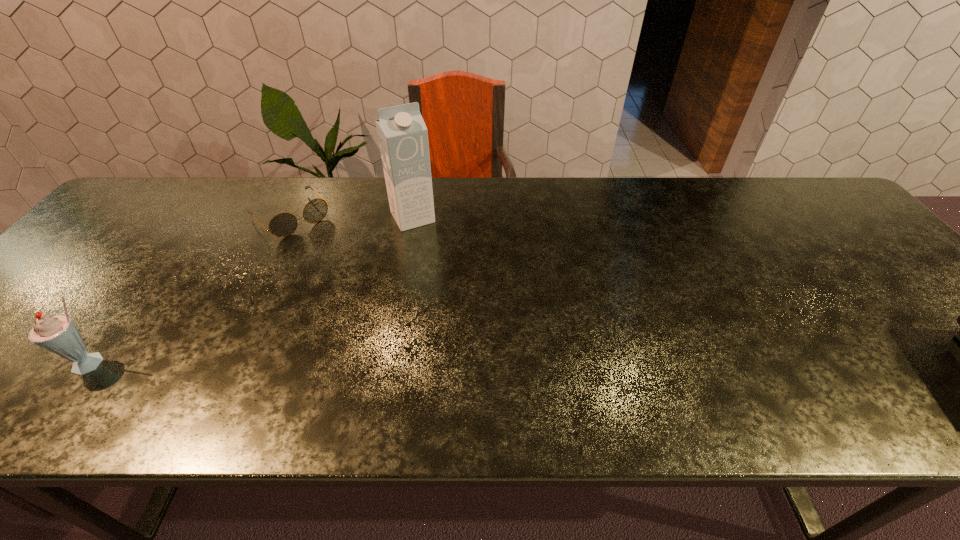
Where is `the third tallest object`? The height and width of the screenshot is (540, 960). the third tallest object is located at coordinates (58, 334).

Find the location of a particular element. The width and height of the screenshot is (960, 540). the leftmost object is located at coordinates (58, 334).

What are the coordinates of `the second object from right to left` in the screenshot? It's located at (402, 134).

The image size is (960, 540). I want to click on carton, so click(x=402, y=134).

Locate an element on the screen. The width and height of the screenshot is (960, 540). sunglasses is located at coordinates (284, 224).

Locate an element on the screen. This screenshot has width=960, height=540. the second object from left to right is located at coordinates (284, 224).

At what (x,y) coordinates should I click in order to perform the action: click on vacant space located 0.180m on the front label of the carton. Please return your answer as a coordinate pair (x, y). This screenshot has height=540, width=960. Looking at the image, I should click on click(x=444, y=272).

You are a GUI agent. You are given a task and a screenshot of the screen. Output one action in this format:
    pyautogui.click(x=<x>, y=<y>)
    Task: Click on the vacant space located 0.270m on the front label of the carton
    
    Given the screenshot: What is the action you would take?
    pyautogui.click(x=459, y=295)

Image resolution: width=960 pixels, height=540 pixels. I want to click on free spot located on the front label of the carton, so click(427, 241).

Identify the location of free spot located 0.280m on the lenses of the shortest object. (365, 289).